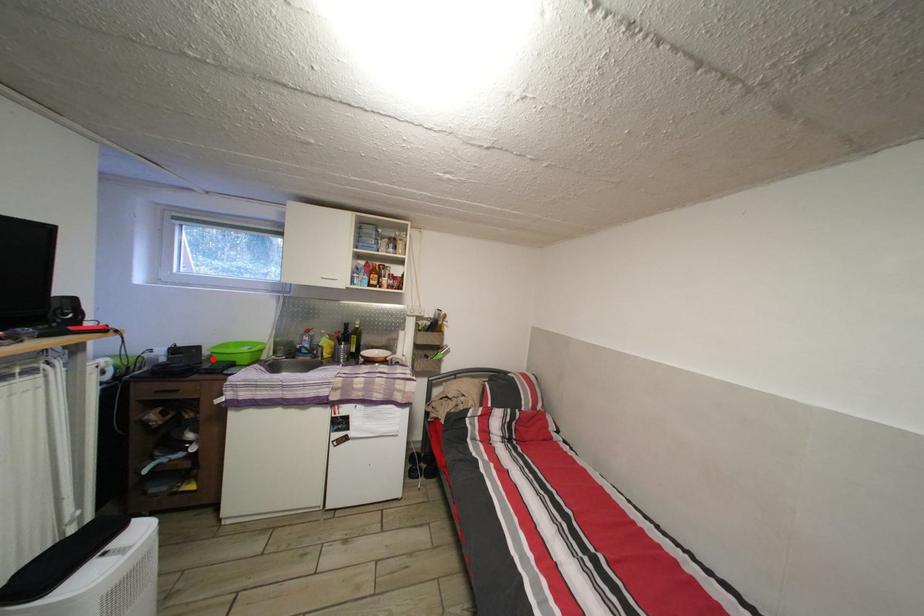
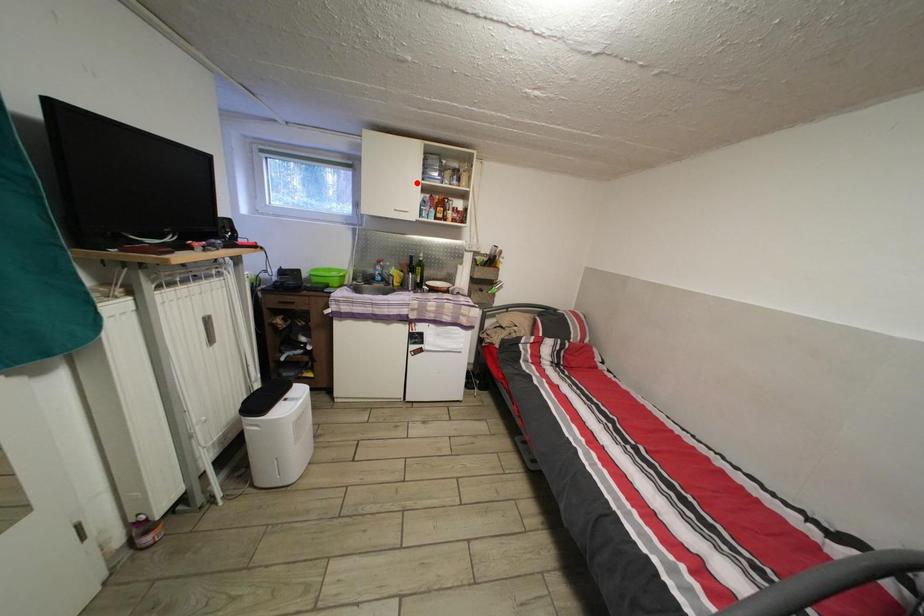
In the scene shown: I am providing you with two images of the same scene from different viewpoints. A red point is marked on the first image and another point is marked on the second image. Is the marked point in image1 the same physical position as the marked point in image2?

No